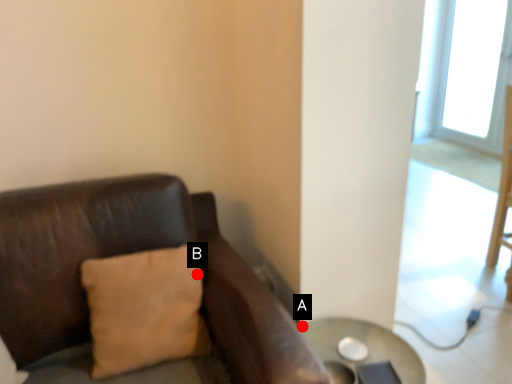
Question: Two points are circled on the image, labeled by A and B beside each circle. Which point is farther from the camera taking this photo?

Choices:
 (A) A is further
 (B) B is further

Answer: (A)